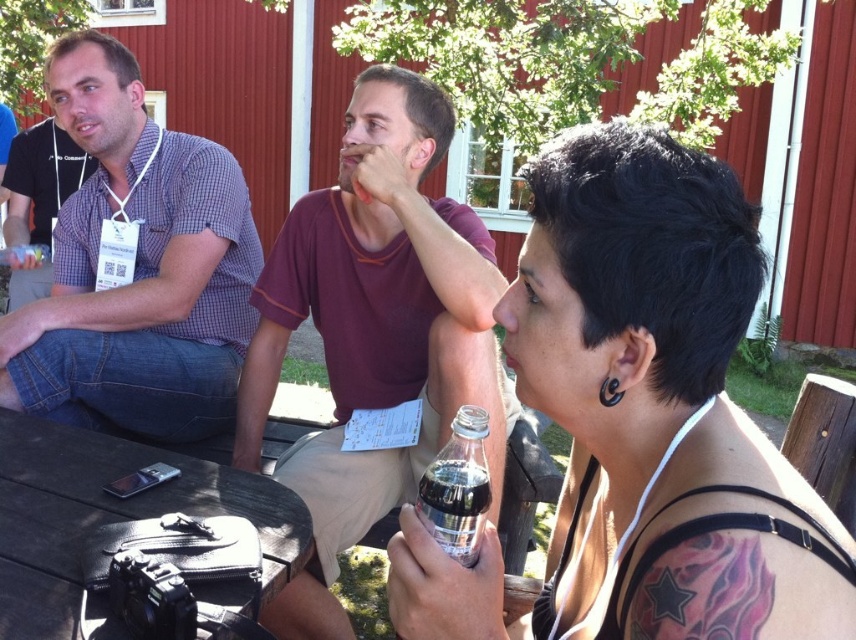
You are planning to place a small vase on the table between the black wood table at lower left and the clear glass bottle at center. If the vase is 30 centimeters wide, will it fit in the space between them?

The black wood table at lower left is 76.20 centimeters away from the clear glass bottle at center. Since the vase is only 30 centimeters wide, it will fit comfortably in the space between them.

You are standing at the picnic table and want to throw a frisbee to a friend who is 2 meters away from you. Is the point at coordinates point (98, 385) within the range you can throw?

The point at coordinates point (98, 385) is 1.81 meters from the viewer, which is within the 2 meter range you can throw. Yes, you can throw the frisbee to that point.